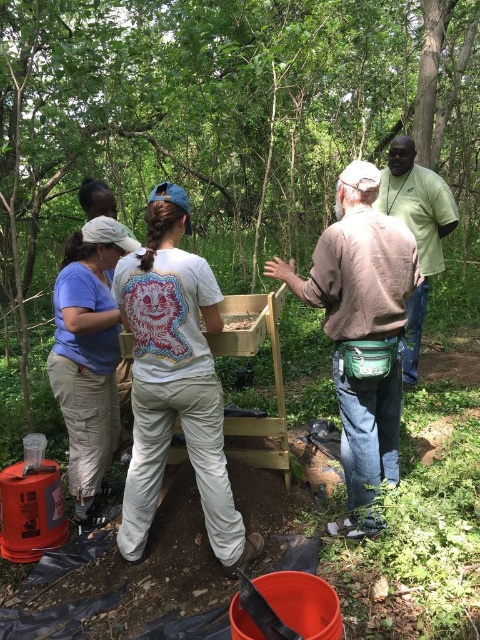
Question: Which of the following is the closest to the observer?

Choices:
 (A) green fabric shirt at upper right
 (B) white cotton shirt at center
 (C) brown leather belt at center

Answer: (B)

Question: Does white cotton shirt at center appear on the left side of matte wooden box at center?

Choices:
 (A) yes
 (B) no

Answer: (A)

Question: Does green fabric shirt at upper right appear on the left side of matte wooden box at center?

Choices:
 (A) no
 (B) yes

Answer: (A)

Question: Which object appears farthest from the camera in this image?

Choices:
 (A) green wood tree at center
 (B) matte wooden box at center
 (C) brown leather belt at center

Answer: (A)

Question: Does brown leather belt at center have a larger size compared to matte wooden box at center?

Choices:
 (A) yes
 (B) no

Answer: (A)

Question: Which object is the closest to the white cotton shirt at center?

Choices:
 (A) brown leather belt at center
 (B) green wood tree at center
 (C) green fabric shirt at upper right
 (D) matte wooden box at center

Answer: (A)